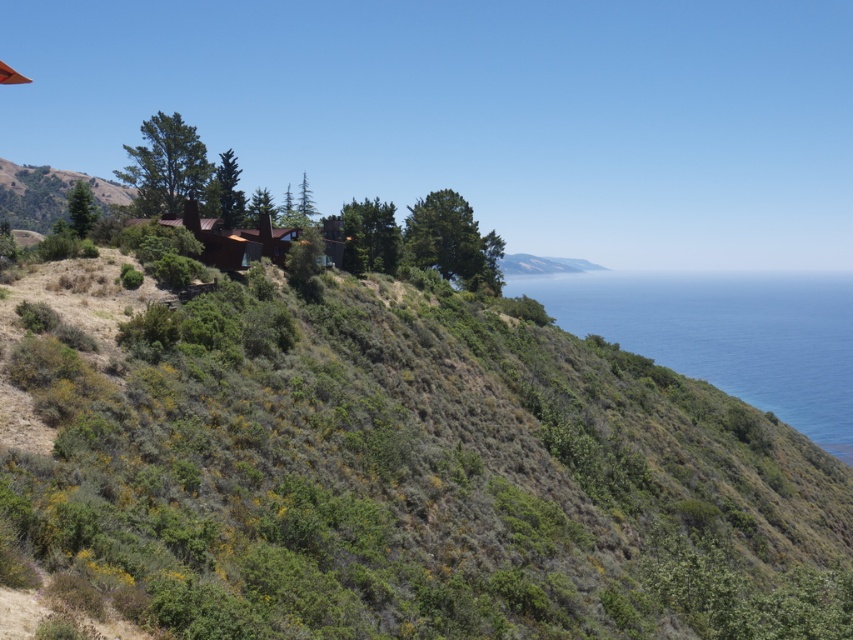
Question: Which point is farther to the camera?

Choices:
 (A) (572, 632)
 (B) (741, 275)

Answer: (B)

Question: Can you confirm if green shrubbery at upper center is wider than blue water at right?

Choices:
 (A) no
 (B) yes

Answer: (A)

Question: Is green shrubbery at upper center positioned before blue water at right?

Choices:
 (A) yes
 (B) no

Answer: (A)

Question: Can you confirm if green shrubbery at upper center is smaller than blue water at right?

Choices:
 (A) no
 (B) yes

Answer: (B)

Question: Which of the following is the farthest from the observer?

Choices:
 (A) green shrubbery at upper center
 (B) blue water at right

Answer: (B)